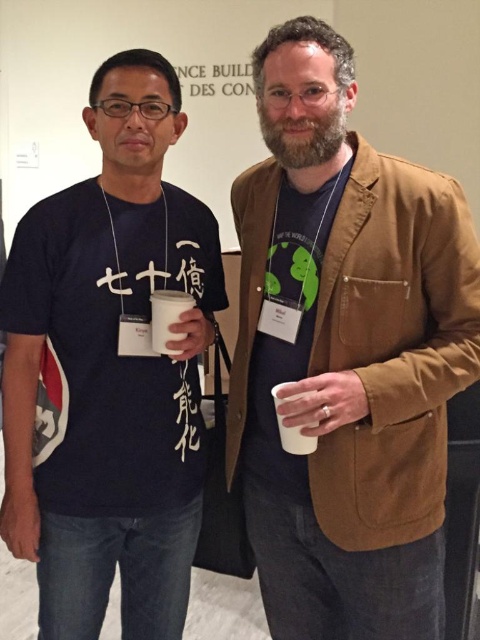
Is brown suede blazer at right taller than matte black t-shirt at center?

No, brown suede blazer at right is not taller than matte black t-shirt at center.

Based on the photo, who is taller, brown suede blazer at right or matte black t-shirt at center?

matte black t-shirt at center is taller.

Who is more forward, (321, 458) or (132, 108)?

Point (321, 458)

At what (x,y) coordinates should I click in order to perform the action: click on brown suede blazer at right. Please return your answer as a coordinate pair (x, y). Looking at the image, I should click on (346, 355).

Can you confirm if matte black t-shirt at center is positioned to the right of white matte cup at center?

In fact, matte black t-shirt at center is to the left of white matte cup at center.

Describe the element at coordinates (109, 371) in the screenshot. This screenshot has width=480, height=640. I see `matte black t-shirt at center` at that location.

Identify the location of matte black t-shirt at center. Image resolution: width=480 pixels, height=640 pixels. (109, 371).

You are a GUI agent. You are given a task and a screenshot of the screen. Output one action in this format:
    pyautogui.click(x=<x>, y=<y>)
    Task: Click on the brown suede blazer at right
    
    Given the screenshot: What is the action you would take?
    pyautogui.click(x=346, y=355)

Does brown suede blazer at right appear on the right side of white matte cup at center?

Correct, you'll find brown suede blazer at right to the right of white matte cup at center.

Is point (269, 465) more distant than point (169, 337)?

Yes, point (269, 465) is behind point (169, 337).

Locate an element on the screen. The width and height of the screenshot is (480, 640). brown suede blazer at right is located at coordinates (346, 355).